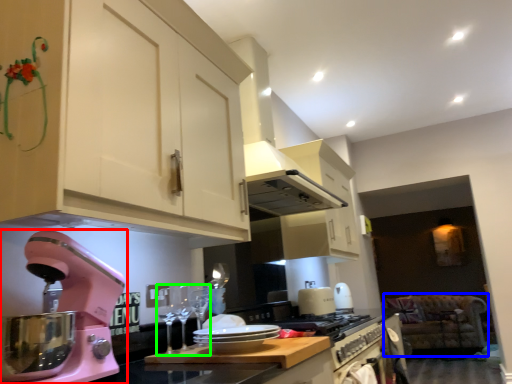
Question: Based on their relative distances, which object is farther from home appliance (highlighted by a red box)? Choose from sit (highlighted by a blue box) and wine glass (highlighted by a green box).

Choices:
 (A) sit
 (B) wine glass

Answer: (A)